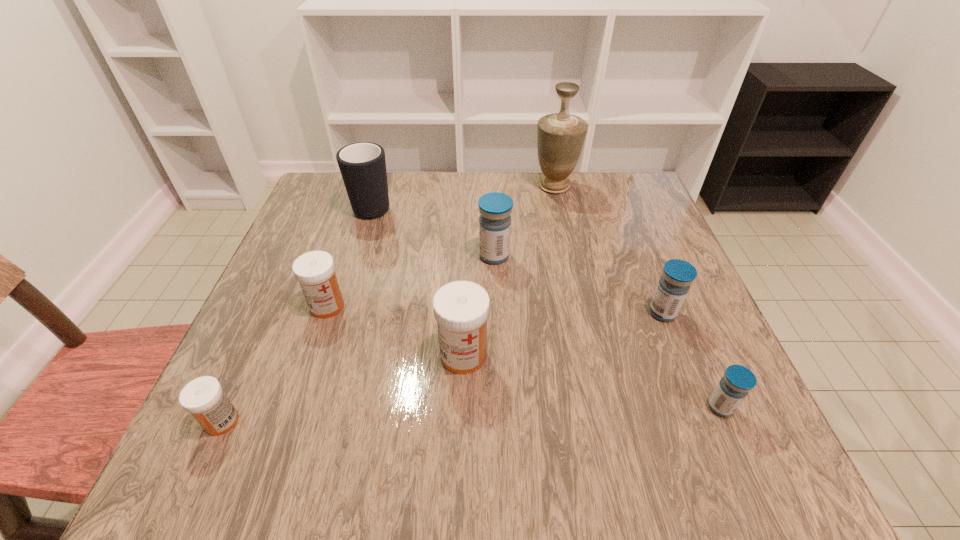
Identify which white medicine is the closest to the fifth medicine from right to left. Please provide its 2D coordinates. Your answer should be formatted as a tuple, i.e. [(x, y)], where the tuple contains the x and y coordinates of a point satisfying the conditions above.

[(203, 397)]